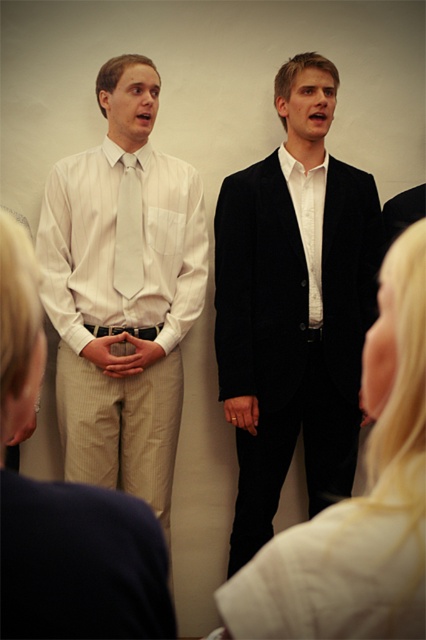
In the scene shown: Can you confirm if white striped shirt at left is positioned above matte white tie at center?

No, white striped shirt at left is not above matte white tie at center.

Looking at this image, is white striped shirt at left wider than matte white tie at center?

Correct, the width of white striped shirt at left exceeds that of matte white tie at center.

Is point (98, 170) positioned in front of point (138, 192)?

No.

Find the location of `white striped shirt at left`. white striped shirt at left is located at coordinates (123, 291).

What do you see at coordinates (359, 499) in the screenshot? I see `blonde hair at center` at bounding box center [359, 499].

Between blonde hair at center and matte white tie at center, which one has less height?

With less height is blonde hair at center.

Image resolution: width=426 pixels, height=640 pixels. What do you see at coordinates (359, 499) in the screenshot? I see `blonde hair at center` at bounding box center [359, 499].

Locate an element on the screen. This screenshot has width=426, height=640. blonde hair at center is located at coordinates (359, 499).

Can you confirm if white satin shirt at left is positioned to the right of matte white tie at center?

No, white satin shirt at left is not to the right of matte white tie at center.

Can you confirm if white satin shirt at left is thinner than matte white tie at center?

In fact, white satin shirt at left might be wider than matte white tie at center.

Describe the element at coordinates (120, 248) in the screenshot. The image size is (426, 640). I see `white satin shirt at left` at that location.

Identify the location of white satin shirt at left. This screenshot has height=640, width=426. (120, 248).